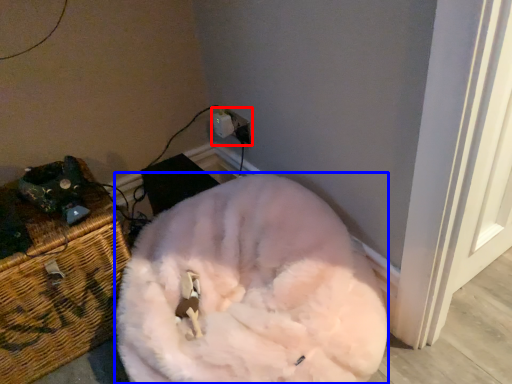
Question: Which point is closer to the camera, electric outlet (highlighted by a red box) or animal (highlighted by a blue box)?

Choices:
 (A) electric outlet
 (B) animal

Answer: (B)